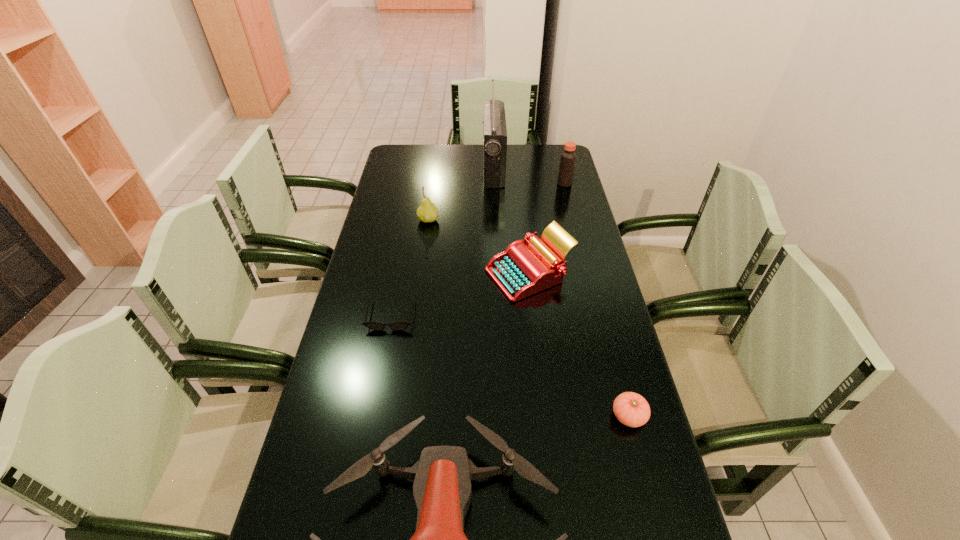
In order to click on typewriter situated at the right edge in this screenshot , I will do `click(522, 270)`.

This screenshot has height=540, width=960. What are the coordinates of `tomato that is at the right edge` in the screenshot? It's located at (631, 409).

This screenshot has height=540, width=960. I want to click on free location at the far edge of the desktop, so click(x=437, y=170).

Identify the location of vacant region at the left edge of the desktop. Image resolution: width=960 pixels, height=540 pixels. (372, 302).

Where is `free space at the right edge`? The width and height of the screenshot is (960, 540). free space at the right edge is located at coordinates (576, 222).

The width and height of the screenshot is (960, 540). In order to click on free space between the radio receiver and the sunglasses in this screenshot , I will do `click(443, 241)`.

Where is `vacant area that lies between the third farthest object and the vinegar`? vacant area that lies between the third farthest object and the vinegar is located at coordinates (496, 201).

Where is `free spot between the radio receiver and the pear`? This screenshot has height=540, width=960. free spot between the radio receiver and the pear is located at coordinates (461, 194).

Find the location of a particular element. This screenshot has width=960, height=540. unoccupied position between the sunglasses and the typewriter is located at coordinates (460, 295).

Where is `blank region between the sunglasses and the fifth nearest object`? Image resolution: width=960 pixels, height=540 pixels. blank region between the sunglasses and the fifth nearest object is located at coordinates pyautogui.click(x=410, y=267).